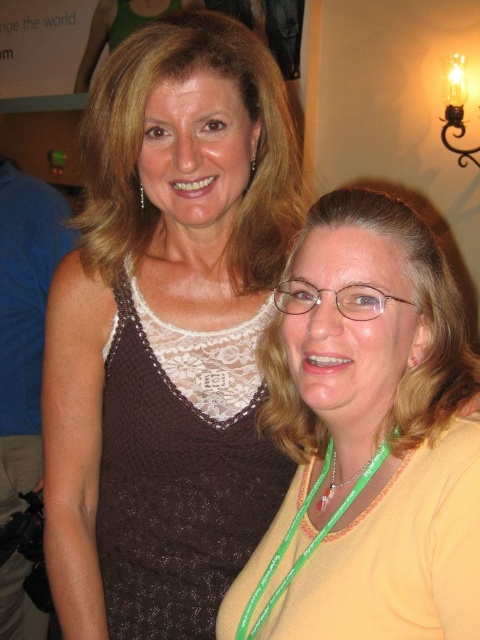
Question: Does brown lace tank top at upper left appear under yellow fabric at center?

Choices:
 (A) no
 (B) yes

Answer: (A)

Question: Does yellow fabric at center appear under brown knitted dress at left?

Choices:
 (A) no
 (B) yes

Answer: (A)

Question: Which object is the farthest from the yellow fabric at center?

Choices:
 (A) brown knitted dress at left
 (B) brown lace tank top at upper left

Answer: (A)

Question: Which point is farther to the camera?

Choices:
 (A) (429, 552)
 (B) (36, 221)

Answer: (B)

Question: Considering the relative positions of brown lace tank top at upper left and yellow fabric at center in the image provided, where is brown lace tank top at upper left located with respect to yellow fabric at center?

Choices:
 (A) above
 (B) below

Answer: (A)

Question: Which of the following is the closest to the observer?

Choices:
 (A) brown lace tank top at upper left
 (B) brown knitted dress at left

Answer: (A)